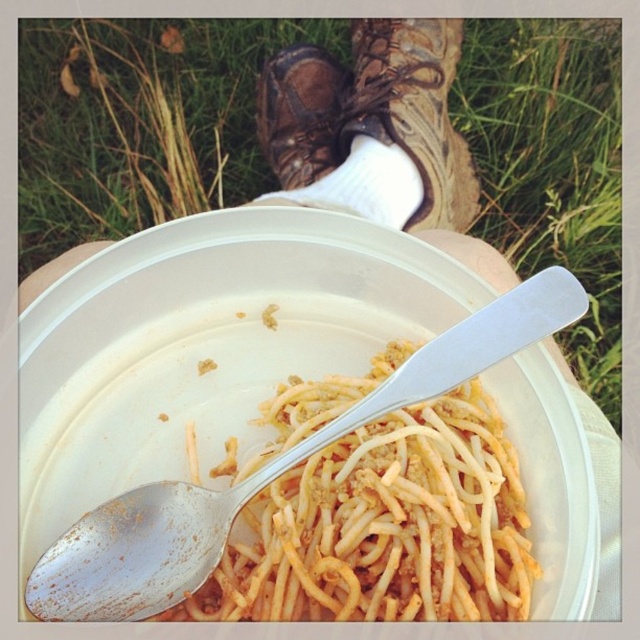
Question: Estimate the real-world distances between objects in this image. Which object is farther from the leather boot at center?

Choices:
 (A) white plastic bowl at center
 (B) green grass at upper center

Answer: (A)

Question: Estimate the real-world distances between objects in this image. Which object is closer to the yellowish matte pasta at center?

Choices:
 (A) leather boot at center
 (B) brown leather boot at upper center
 (C) white plastic bowl at center
 (D) green grass at upper center

Answer: (C)

Question: Is yellowish matte pasta at center to the right of brown leather boot at upper center from the viewer's perspective?

Choices:
 (A) yes
 (B) no

Answer: (A)

Question: Based on their relative distances, which object is farther from the leather boot at center?

Choices:
 (A) green grass at upper center
 (B) brown leather boot at upper center
 (C) white plastic bowl at center
 (D) yellowish matte pasta at center

Answer: (D)

Question: Does white plastic bowl at center appear under brown leather boot at upper center?

Choices:
 (A) yes
 (B) no

Answer: (A)

Question: Can you confirm if green grass at upper center is positioned to the left of white plastic bowl at center?

Choices:
 (A) no
 (B) yes

Answer: (B)